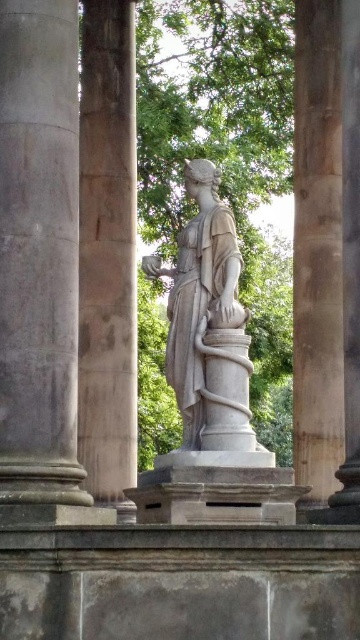
Which is behind, point (48, 339) or point (113, 147)?

Positioned behind is point (113, 147).

Between gray stone column at left and smooth stone column at center, which one appears on the right side from the viewer's perspective?

smooth stone column at center is more to the right.

This screenshot has width=360, height=640. What do you see at coordinates (38, 252) in the screenshot?
I see `gray stone column at left` at bounding box center [38, 252].

I want to click on gray stone column at left, so click(38, 252).

Is smooth stone column at right taller than white marble statue at center?

Yes, smooth stone column at right is taller than white marble statue at center.

Between smooth stone column at right and white marble statue at center, which one has less height?

white marble statue at center is shorter.

Find the location of a particular element. smooth stone column at right is located at coordinates (317, 252).

Which is more to the right, gray stone column at left or smooth stone column at right?

smooth stone column at right is more to the right.

Who is more forward, (x=42, y=314) or (x=308, y=401)?

Positioned in front is point (x=42, y=314).

At what (x,y) coordinates should I click in order to perform the action: click on gray stone column at left. Please return your answer as a coordinate pair (x, y). Image resolution: width=360 pixels, height=640 pixels. Looking at the image, I should click on (38, 252).